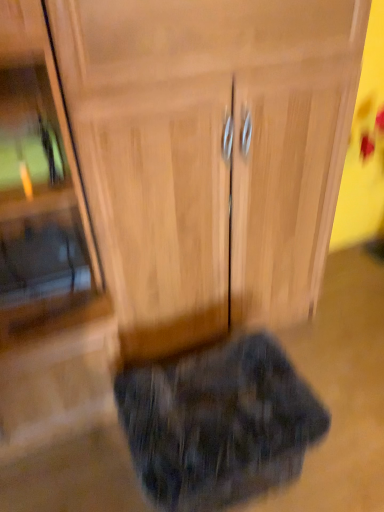
Image resolution: width=384 pixels, height=512 pixels. I want to click on blank space situated above fluffy dark gray cat at lower center (from a real-world perspective), so [216, 397].